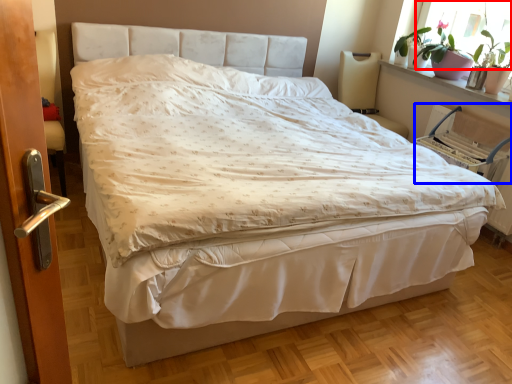
Question: Which of the following is the closest to the observer, window screen (highlighted by a red box) or armchair (highlighted by a blue box)?

Choices:
 (A) window screen
 (B) armchair

Answer: (B)